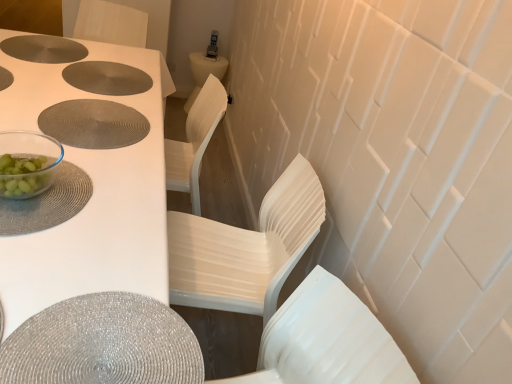
Find the location of a particular element. This screenshot has width=512, height=384. free location above shiny silver placemat at lower left (from a real-world perspective) is located at coordinates (106, 340).